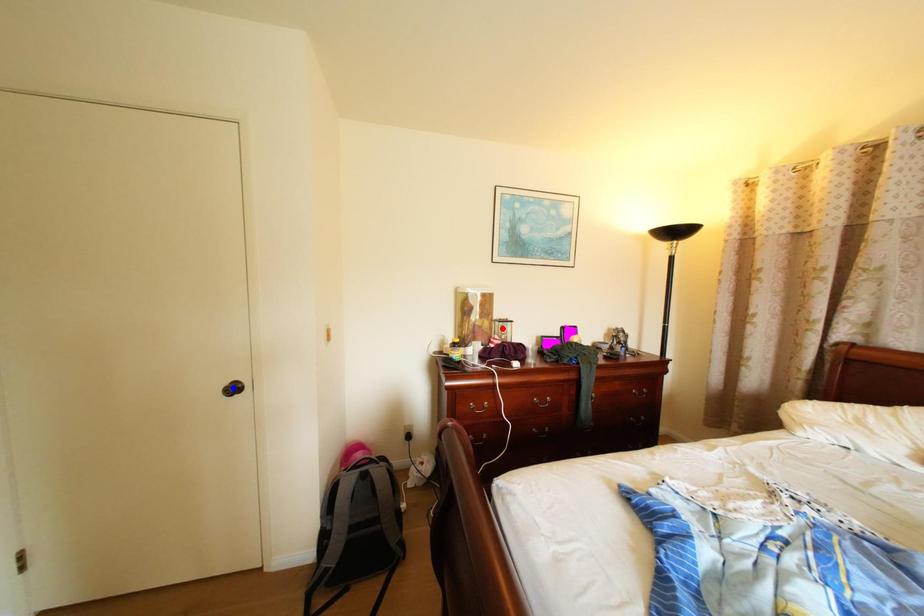
Question: Two points are marked on the image. Which point is closer to the camera?

Choices:
 (A) Blue point is closer.
 (B) Red point is closer.

Answer: (A)